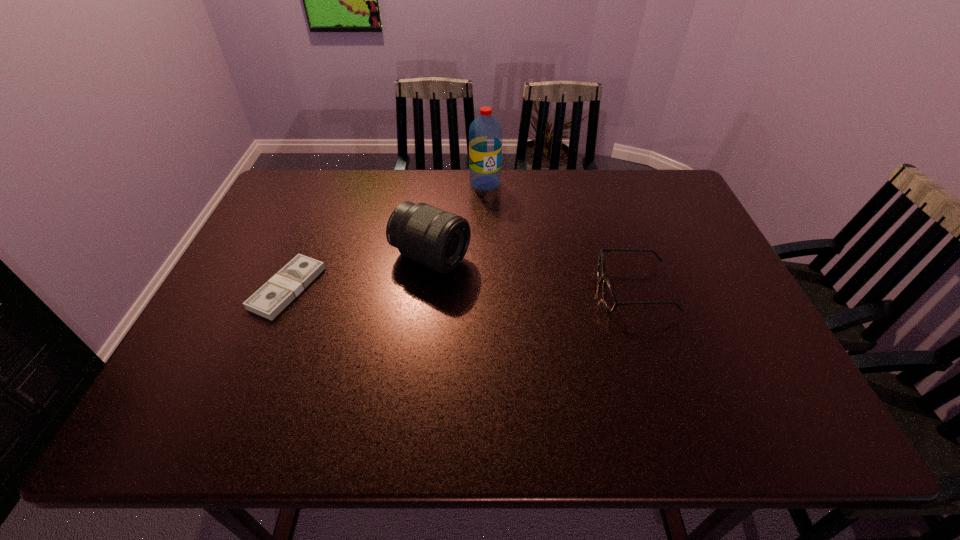
Where is `the shortest object`? The height and width of the screenshot is (540, 960). the shortest object is located at coordinates (278, 292).

You are a GUI agent. You are given a task and a screenshot of the screen. Output one action in this format:
    pyautogui.click(x=<x>, y=<y>)
    Task: Click on the leftmost object
    The height and width of the screenshot is (540, 960).
    Given the screenshot: What is the action you would take?
    pyautogui.click(x=278, y=292)

The image size is (960, 540). What are the coordinates of `the second shortest object` in the screenshot? It's located at (609, 297).

The height and width of the screenshot is (540, 960). What are the coordinates of `the rightmost object` in the screenshot? It's located at (609, 297).

Where is `the tallest object`? The image size is (960, 540). the tallest object is located at coordinates (485, 133).

Where is `the farthest object`? The height and width of the screenshot is (540, 960). the farthest object is located at coordinates 485,133.

The width and height of the screenshot is (960, 540). Find the location of `the second tallest object`. the second tallest object is located at coordinates (438, 239).

Locate an element on the screen. The image size is (960, 540). free space located 0.200m on the right of the leftmost object is located at coordinates (398, 288).

This screenshot has height=540, width=960. Identify the location of vacant space located on the front-facing side of the rightmost object. (554, 291).

Where is `vacant space positioned 0.390m on the front-facing side of the rightmost object`? Image resolution: width=960 pixels, height=540 pixels. vacant space positioned 0.390m on the front-facing side of the rightmost object is located at coordinates [442, 291].